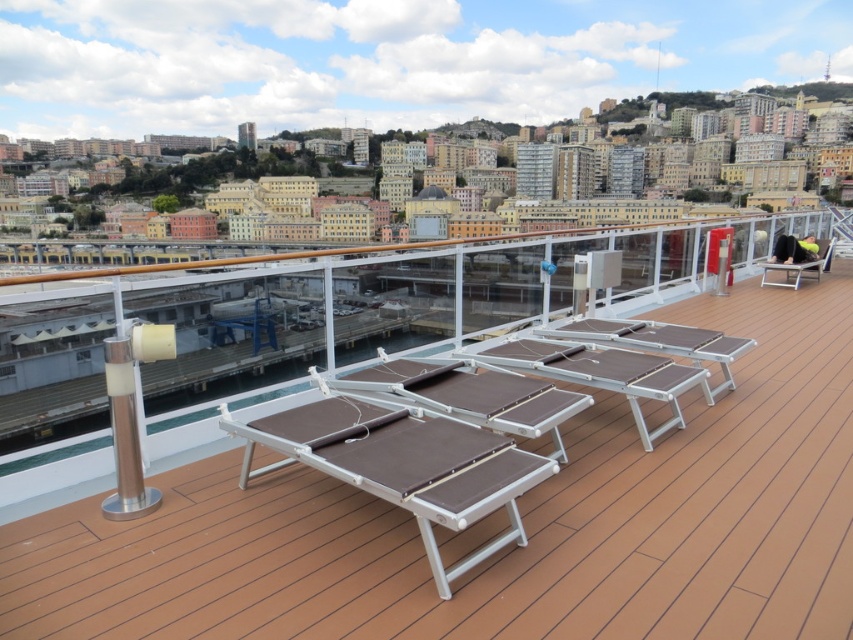
Is brown wood deck at center thinner than brown fabric chair at right?

No, brown wood deck at center is not thinner than brown fabric chair at right.

Is point (248, 620) more distant than point (790, 268)?

No, (248, 620) is closer to viewer.

Locate an element on the screen. Image resolution: width=853 pixels, height=640 pixels. brown wood deck at center is located at coordinates (521, 518).